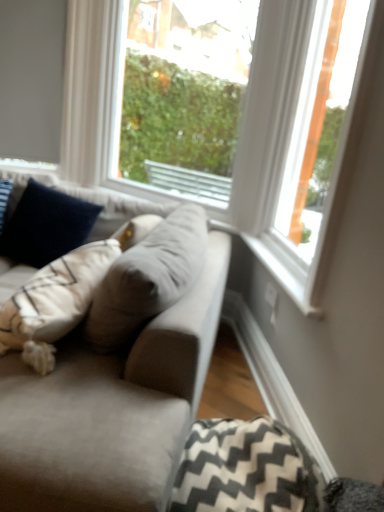
Find the location of `white wood frame at upper right, acting as the first window starting from the right`. white wood frame at upper right, acting as the first window starting from the right is located at coordinates (289, 142).

From the picture: Measure the distance between point (69, 434) and camera.

Point (69, 434) is 1.13 meters from camera.

What is the approximate height of transparent glass window at center, the first window in the left-to-right sequence?

transparent glass window at center, the first window in the left-to-right sequence, is 1.32 meters tall.

I want to click on white wood frame at upper right, which is counted as the 2th window, starting from the left, so click(x=289, y=142).

Is transparent glass window at center, the first window in the left-to-right sequence, looking in the opposite direction of black-and-white zigzag fabric pillow at lower right, the first pillow viewed from the right?

No, transparent glass window at center, the first window in the left-to-right sequence, is not facing the opposite direction of black-and-white zigzag fabric pillow at lower right, the first pillow viewed from the right.

Is point (152, 60) closer or farther from the camera than point (311, 478)?

Point (152, 60) is positioned farther from the camera compared to point (311, 478).

Is transparent glass window at center, which is counted as the 2th window, starting from the right, to the left or to the right of black-and-white zigzag fabric pillow at lower right, acting as the second pillow starting from the top, in the image?

From the image, it's evident that transparent glass window at center, which is counted as the 2th window, starting from the right, is to the left of black-and-white zigzag fabric pillow at lower right, acting as the second pillow starting from the top.

From a real-world perspective, which object stands above the other?

transparent glass window at center, which is counted as the 2th window, starting from the right.

Considering the sizes of objects velvety navy blue pillow at left, which appears as the 1th pillow when viewed from the back, and transparent glass window at center, which is counted as the 2th window, starting from the right, in the image provided, who is thinner, velvety navy blue pillow at left, which appears as the 1th pillow when viewed from the back, or transparent glass window at center, which is counted as the 2th window, starting from the right,?

transparent glass window at center, which is counted as the 2th window, starting from the right.

Can you tell me how much velvety navy blue pillow at left, the second pillow in the right-to-left sequence, and transparent glass window at center, which is counted as the 2th window, starting from the right, differ in facing direction?

18.5 degrees.

From a real-world perspective, count 1st pillows downward from the transparent glass window at center, which is counted as the 2th window, starting from the right, and point to it. Please provide its 2D coordinates.

[(46, 225)]

Is velvety navy blue pillow at left, marked as the second pillow in a bottom-to-top arrangement, in front of transparent glass window at center, the first window in the left-to-right sequence?

Yes, velvety navy blue pillow at left, marked as the second pillow in a bottom-to-top arrangement, is closer to the viewer.

Is white wood frame at upper right, acting as the first window starting from the right, thinner than suede gray couch at center?

Yes.

From the image's perspective, does white wood frame at upper right, which is counted as the 2th window, starting from the left, appear lower than suede gray couch at center?

Actually, white wood frame at upper right, which is counted as the 2th window, starting from the left, appears above suede gray couch at center in the image.

Considering the sizes of objects white wood frame at upper right, acting as the first window starting from the right, and suede gray couch at center in the image provided, who is smaller, white wood frame at upper right, acting as the first window starting from the right, or suede gray couch at center?

With smaller size is white wood frame at upper right, acting as the first window starting from the right.

From a real-world perspective, who is located lower, white wood frame at upper right, which is counted as the 2th window, starting from the left, or suede gray couch at center?

suede gray couch at center.

Is suede gray couch at center oriented towards black-and-white zigzag fabric pillow at lower right, acting as the second pillow starting from the top?

No, suede gray couch at center is not oriented towards black-and-white zigzag fabric pillow at lower right, acting as the second pillow starting from the top.

In terms of height, does suede gray couch at center look taller or shorter compared to black-and-white zigzag fabric pillow at lower right, which appears as the first pillow when viewed from the front?

Clearly, suede gray couch at center is taller compared to black-and-white zigzag fabric pillow at lower right, which appears as the first pillow when viewed from the front.

Considering the relative sizes of suede gray couch at center and black-and-white zigzag fabric pillow at lower right, which is the second pillow from left to right, in the image provided, is suede gray couch at center bigger than black-and-white zigzag fabric pillow at lower right, which is the second pillow from left to right,?

Indeed, suede gray couch at center has a larger size compared to black-and-white zigzag fabric pillow at lower right, which is the second pillow from left to right.

Is suede gray couch at center beside black-and-white zigzag fabric pillow at lower right, which is the 1th pillow in bottom-to-top order?

No, suede gray couch at center is not in contact with black-and-white zigzag fabric pillow at lower right, which is the 1th pillow in bottom-to-top order.

Who is bigger, transparent glass window at center, which is counted as the 2th window, starting from the right, or suede gray couch at center?

Bigger between the two is suede gray couch at center.

Who is shorter, transparent glass window at center, which is counted as the 2th window, starting from the right, or suede gray couch at center?

Standing shorter between the two is suede gray couch at center.

Is point (140, 134) in front of point (99, 367)?

No.

From the image's perspective, which is above, transparent glass window at center, the first window in the left-to-right sequence, or suede gray couch at center?

transparent glass window at center, the first window in the left-to-right sequence, is shown above in the image.

Can you confirm if transparent glass window at center, which is counted as the 2th window, starting from the right, is taller than white wood frame at upper right, acting as the first window starting from the right?

Indeed, transparent glass window at center, which is counted as the 2th window, starting from the right, has a greater height compared to white wood frame at upper right, acting as the first window starting from the right.

Where is `window lying on the right of transparent glass window at center, the first window in the left-to-right sequence`? The width and height of the screenshot is (384, 512). window lying on the right of transparent glass window at center, the first window in the left-to-right sequence is located at coordinates (289, 142).

Are transparent glass window at center, which is counted as the 2th window, starting from the right, and white wood frame at upper right, which is counted as the 2th window, starting from the left, located far from each other?

Absolutely, transparent glass window at center, which is counted as the 2th window, starting from the right, is distant from white wood frame at upper right, which is counted as the 2th window, starting from the left.

Considering the sizes of objects transparent glass window at center, the first window in the left-to-right sequence, and white wood frame at upper right, acting as the first window starting from the right, in the image provided, who is smaller, transparent glass window at center, the first window in the left-to-right sequence, or white wood frame at upper right, acting as the first window starting from the right,?

With smaller size is white wood frame at upper right, acting as the first window starting from the right.

Is suede gray couch at center taller or shorter than transparent glass window at center, the first window in the left-to-right sequence?

In the image, suede gray couch at center appears to be shorter than transparent glass window at center, the first window in the left-to-right sequence.

In the image, is suede gray couch at center positioned in front of or behind transparent glass window at center, which is counted as the 2th window, starting from the right?

In the image, suede gray couch at center appears in front of transparent glass window at center, which is counted as the 2th window, starting from the right.

Is suede gray couch at center facing towards transparent glass window at center, which is counted as the 2th window, starting from the right?

No, suede gray couch at center is not aimed at transparent glass window at center, which is counted as the 2th window, starting from the right.

Considering the sizes of objects suede gray couch at center and transparent glass window at center, the first window in the left-to-right sequence, in the image provided, who is thinner, suede gray couch at center or transparent glass window at center, the first window in the left-to-right sequence,?

transparent glass window at center, the first window in the left-to-right sequence, is thinner.

The height and width of the screenshot is (512, 384). Find the location of `window on the left of the black-and-white zigzag fabric pillow at lower right, placed as the 2th pillow when sorted from back to front`. window on the left of the black-and-white zigzag fabric pillow at lower right, placed as the 2th pillow when sorted from back to front is located at coordinates (184, 94).

Starting from the transparent glass window at center, which is counted as the 2th window, starting from the right, which pillow is the 1st one in front? Please provide its 2D coordinates.

[(46, 225)]

Estimate the real-world distances between objects in this image. Which object is further from velvety navy blue pillow at left, which appears as the 1th pillow when viewed from the back, suede gray couch at center or white wood frame at upper right, acting as the first window starting from the right?

Based on the image, white wood frame at upper right, acting as the first window starting from the right, appears to be further to velvety navy blue pillow at left, which appears as the 1th pillow when viewed from the back.

Based on their spatial positions, is black-and-white zigzag fabric pillow at lower right, placed as the 2th pillow when sorted from back to front, or transparent glass window at center, which is counted as the 2th window, starting from the right, further from suede gray couch at center?

transparent glass window at center, which is counted as the 2th window, starting from the right, is positioned further to the anchor suede gray couch at center.

Considering their positions, is suede gray couch at center positioned further to black-and-white zigzag fabric pillow at lower right, which appears as the first pillow when viewed from the front, than transparent glass window at center, the first window in the left-to-right sequence?

Based on the image, transparent glass window at center, the first window in the left-to-right sequence, appears to be further to black-and-white zigzag fabric pillow at lower right, which appears as the first pillow when viewed from the front.

Which object lies nearer to the anchor point black-and-white zigzag fabric pillow at lower right, which is the second pillow from left to right, suede gray couch at center or white wood frame at upper right, which is counted as the 2th window, starting from the left?

suede gray couch at center is positioned closer to the anchor black-and-white zigzag fabric pillow at lower right, which is the second pillow from left to right.

Based on their spatial positions, is suede gray couch at center or white wood frame at upper right, acting as the first window starting from the right, closer to transparent glass window at center, which is counted as the 2th window, starting from the right?

Among the two, white wood frame at upper right, acting as the first window starting from the right, is located nearer to transparent glass window at center, which is counted as the 2th window, starting from the right.

From the image, which object appears to be farther from black-and-white zigzag fabric pillow at lower right, which appears as the first pillow when viewed from the front, suede gray couch at center or velvety navy blue pillow at left, which appears as the 2th pillow when viewed from the front?

The object further to black-and-white zigzag fabric pillow at lower right, which appears as the first pillow when viewed from the front, is velvety navy blue pillow at left, which appears as the 2th pillow when viewed from the front.

Which object lies further to the anchor point black-and-white zigzag fabric pillow at lower right, the first pillow viewed from the right, transparent glass window at center, which is counted as the 2th window, starting from the right, or white wood frame at upper right, acting as the first window starting from the right?

transparent glass window at center, which is counted as the 2th window, starting from the right, lies further to black-and-white zigzag fabric pillow at lower right, the first pillow viewed from the right, than the other object.

Which object lies further to the anchor point transparent glass window at center, the first window in the left-to-right sequence, black-and-white zigzag fabric pillow at lower right, which is the 1th pillow in bottom-to-top order, or suede gray couch at center?

Based on the image, black-and-white zigzag fabric pillow at lower right, which is the 1th pillow in bottom-to-top order, appears to be further to transparent glass window at center, the first window in the left-to-right sequence.

At what (x,y) coordinates should I click in order to perform the action: click on pillow positioned between suede gray couch at center and velvety navy blue pillow at left, the 1th pillow viewed from the top, from near to far. Please return your answer as a coordinate pair (x, y). The width and height of the screenshot is (384, 512). Looking at the image, I should click on (245, 469).

Where is `studio couch between transparent glass window at center, which is counted as the 2th window, starting from the right, and black-and-white zigzag fabric pillow at lower right, placed as the 2th pillow when sorted from back to front, in the up-down direction`? studio couch between transparent glass window at center, which is counted as the 2th window, starting from the right, and black-and-white zigzag fabric pillow at lower right, placed as the 2th pillow when sorted from back to front, in the up-down direction is located at coordinates (111, 409).

What are the coordinates of `window situated between velvety navy blue pillow at left, the second pillow in the right-to-left sequence, and white wood frame at upper right, which is counted as the 2th window, starting from the left, from left to right` in the screenshot? It's located at (184, 94).

At what (x,y) coordinates should I click in order to perform the action: click on pillow between white wood frame at upper right, which is counted as the 2th window, starting from the left, and black-and-white zigzag fabric pillow at lower right, the first pillow viewed from the right, from top to bottom. Please return your answer as a coordinate pair (x, y). This screenshot has width=384, height=512. Looking at the image, I should click on (46, 225).